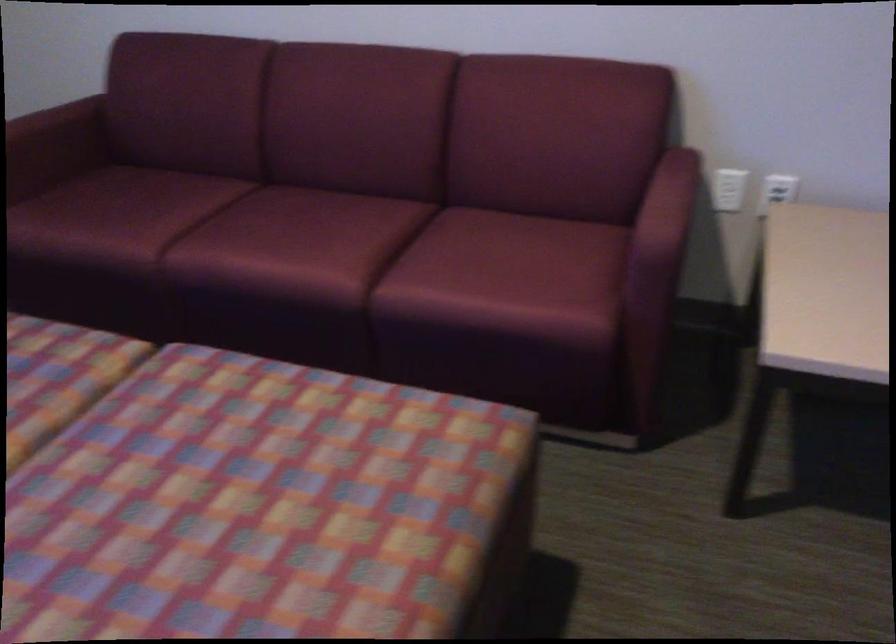
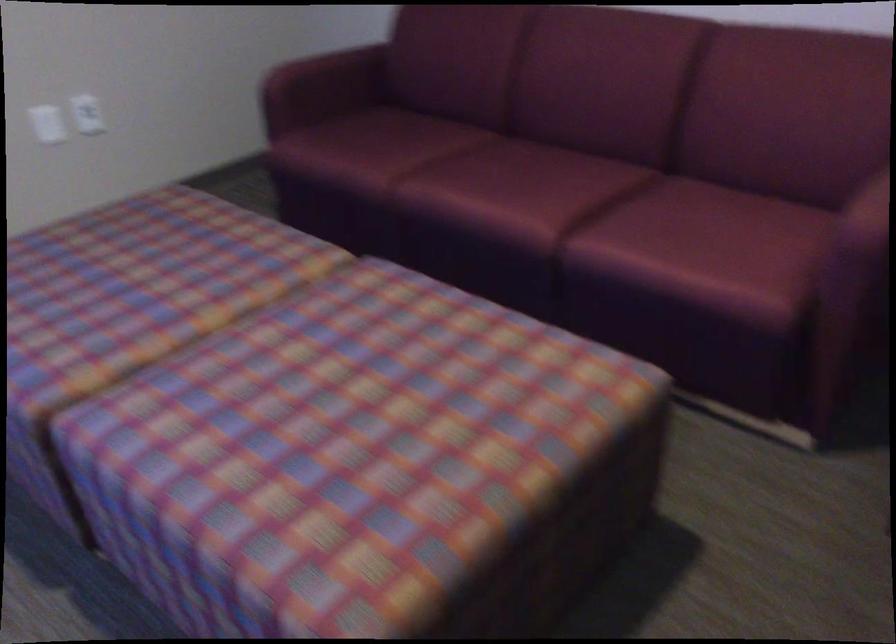
Question: In a continuous first-person perspective shot, in which direction is the camera moving?

Choices:
 (A) Left
 (B) Right
 (C) Forward
 (D) Backward

Answer: (B)